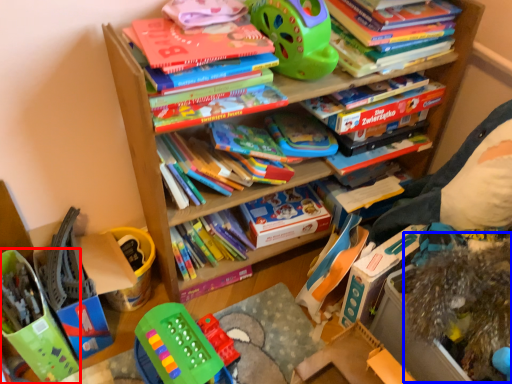
Question: Among these objects, which one is farthest to the camera, toy (highlighted by a red box) or toy (highlighted by a blue box)?

Choices:
 (A) toy
 (B) toy

Answer: (A)